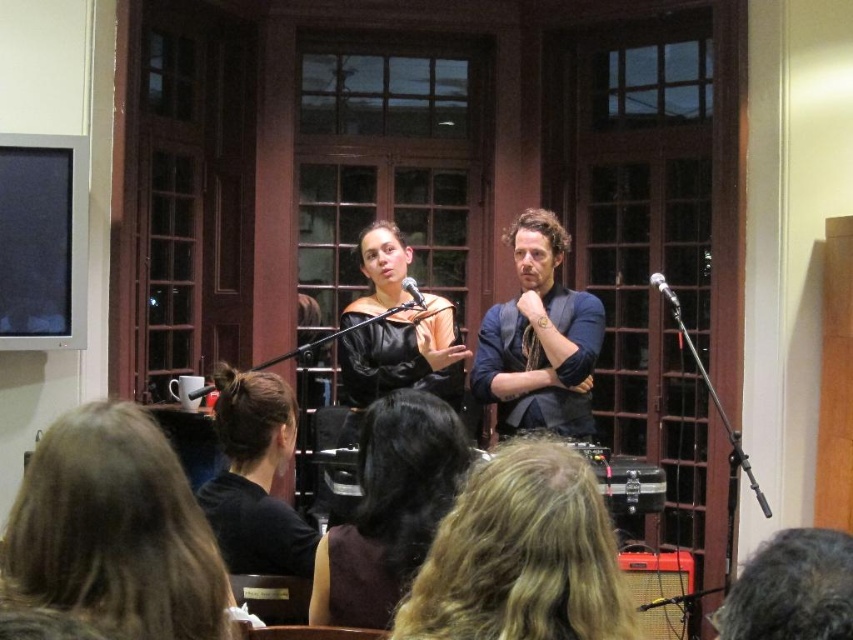
You are an event planner setting up a photo shoot at the venue. You need to position a camera so that both the dark brown leather jacket at center and the metallic silver microphone at upper center are in frame. Which object should you focus on first to ensure both are visible?

The dark brown leather jacket at center should be focused on first since it is taller than the metallic silver microphone at upper center, ensuring it doesn

You are an event planner setting up a stage for a presentation. You need to ensure that the dark brown leather jacket at center and the metallic silver microphone at upper center are visible to the audience. Based on their positions, which object is closer to the audience? Please explain your reasoning.

The metallic silver microphone at upper center is closer to the audience because it is positioned at upper center, while the dark brown leather jacket at center is below it. Since the microphone is above the jacket, it would be in a more forward position relative to the audience viewing from the front of the stage.